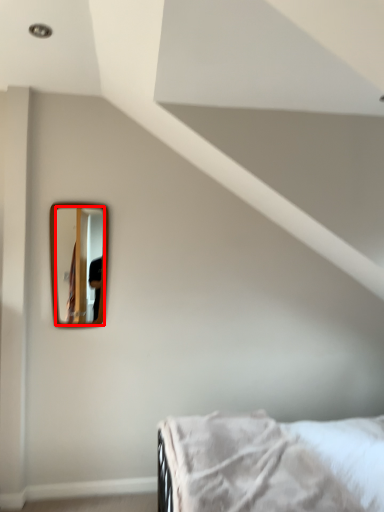
Question: From the image's perspective, what is the correct spatial relationship of mirror (annotated by the red box) in relation to bed?

Choices:
 (A) above
 (B) below

Answer: (A)